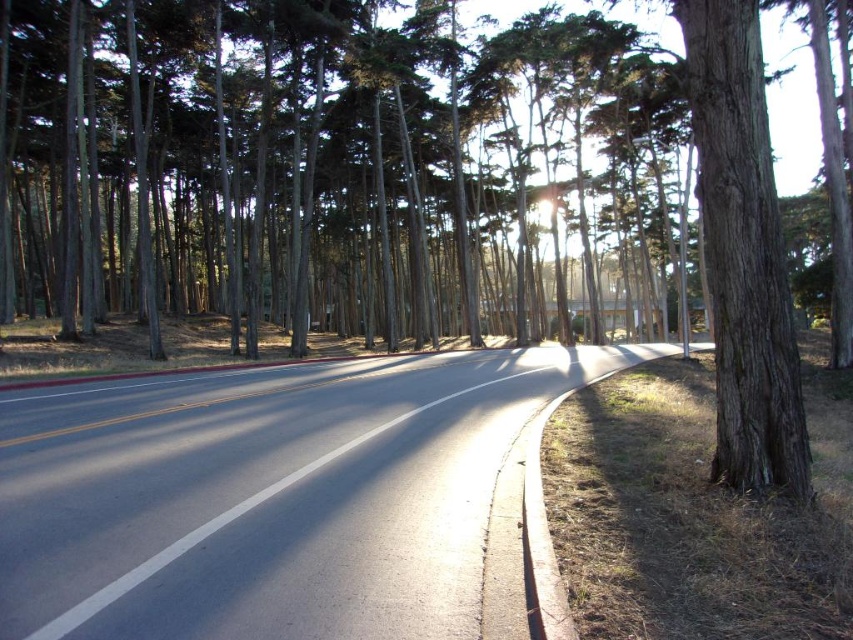
Question: Where is asphalt road at center located in relation to brown rough bark tree at right in the image?

Choices:
 (A) right
 (B) left

Answer: (B)

Question: Which of the following is the farthest from the observer?

Choices:
 (A) asphalt road at center
 (B) brown rough bark tree at right

Answer: (B)

Question: Does asphalt road at center appear under brown rough bark tree at right?

Choices:
 (A) yes
 (B) no

Answer: (A)

Question: Does asphalt road at center appear over brown rough bark tree at right?

Choices:
 (A) yes
 (B) no

Answer: (B)